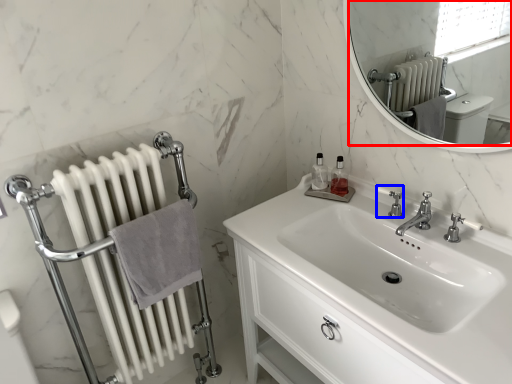
Question: Which point is closer to the camera, mirror (highlighted by a red box) or plumbing fixture (highlighted by a blue box)?

Choices:
 (A) mirror
 (B) plumbing fixture

Answer: (A)